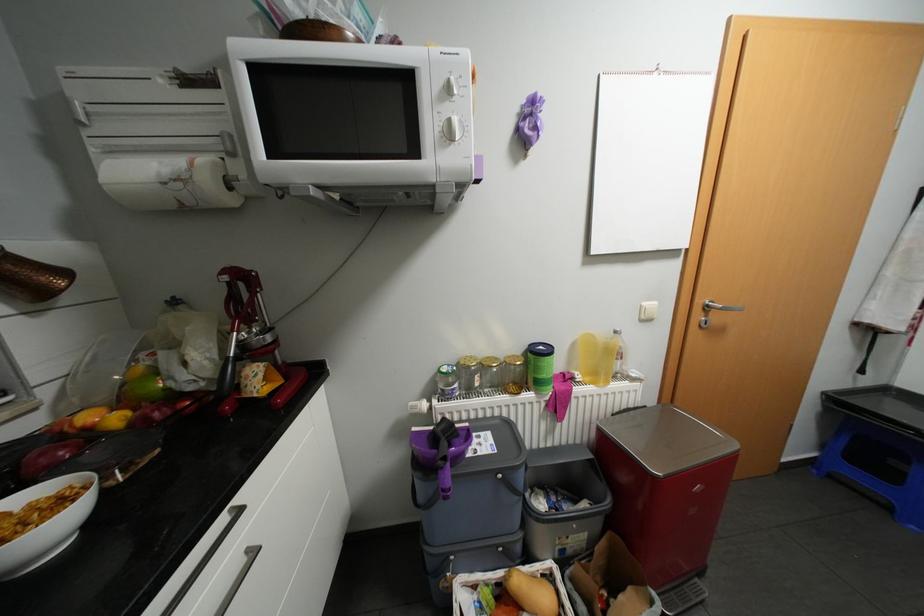
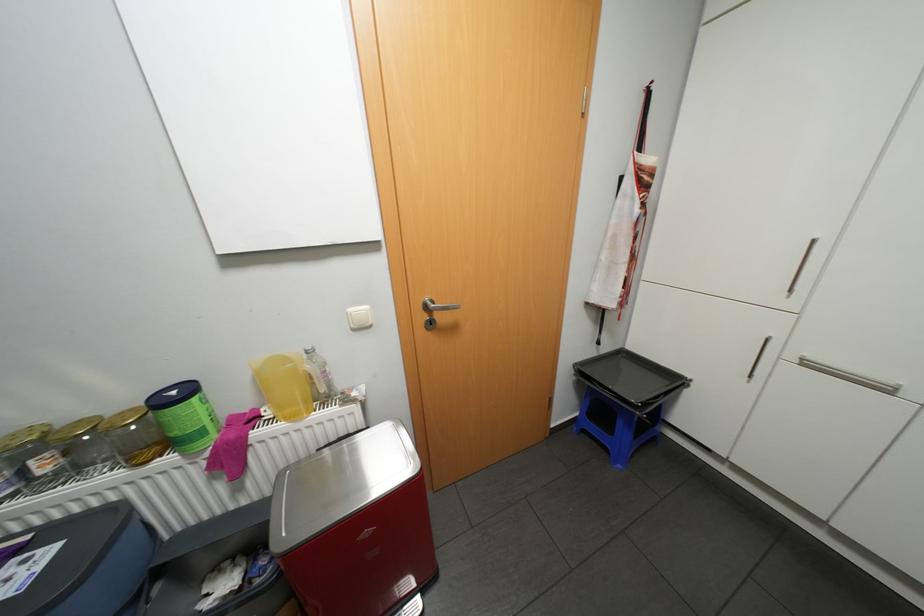
Question: The camera is either moving clockwise (left) or counter-clockwise (right) around the object. The first image is from the beginning of the video and the second image is from the end. Is the camera moving left or right when shooting the video?

Choices:
 (A) Left
 (B) Right

Answer: (A)